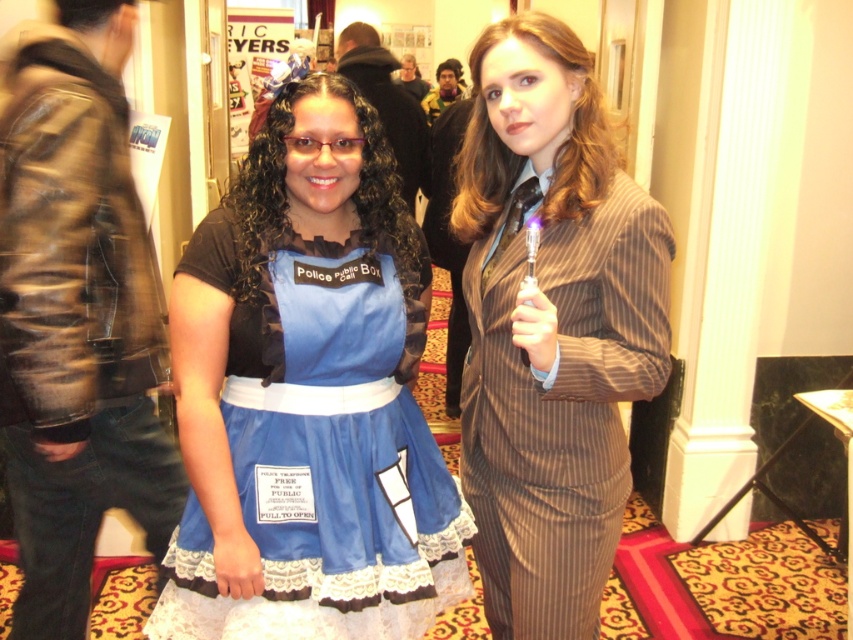
Question: Which point appears farthest from the camera in this image?

Choices:
 (A) (292, 257)
 (B) (57, 579)

Answer: (B)

Question: Which object appears closest to the camera in this image?

Choices:
 (A) leather jacket at left
 (B) brown pinstripe dress at center

Answer: (B)

Question: Is blue satin dress at center closer to camera compared to matte black dress at center?

Choices:
 (A) yes
 (B) no

Answer: (A)

Question: Can you confirm if black leather jacket at upper center is positioned to the left of matte black dress at center?

Choices:
 (A) no
 (B) yes

Answer: (B)

Question: Which of the following is the farthest from the observer?

Choices:
 (A) (427, 116)
 (B) (514, 195)
 (C) (407, 148)

Answer: (A)

Question: Can you confirm if brown pinstripe dress at center is smaller than matte black dress at center?

Choices:
 (A) yes
 (B) no

Answer: (B)